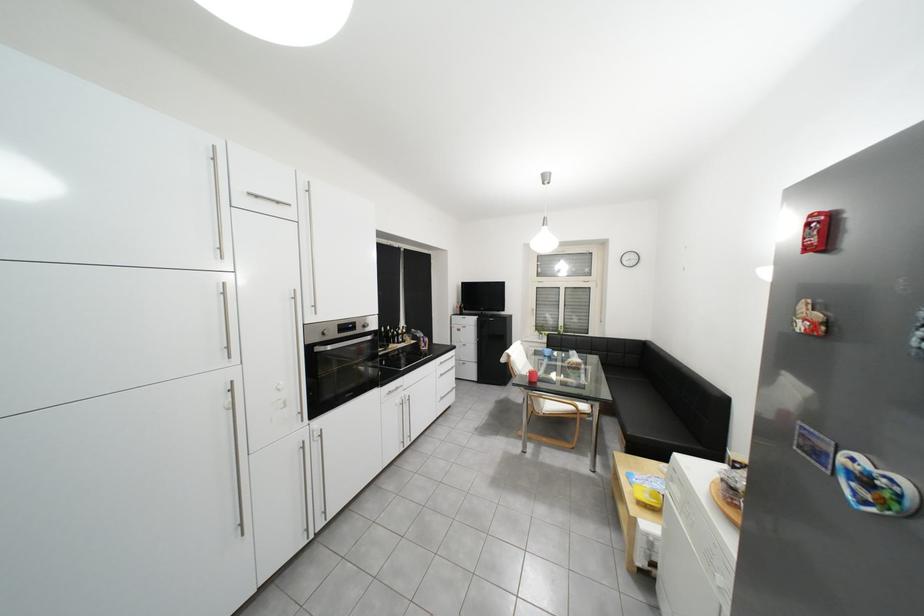
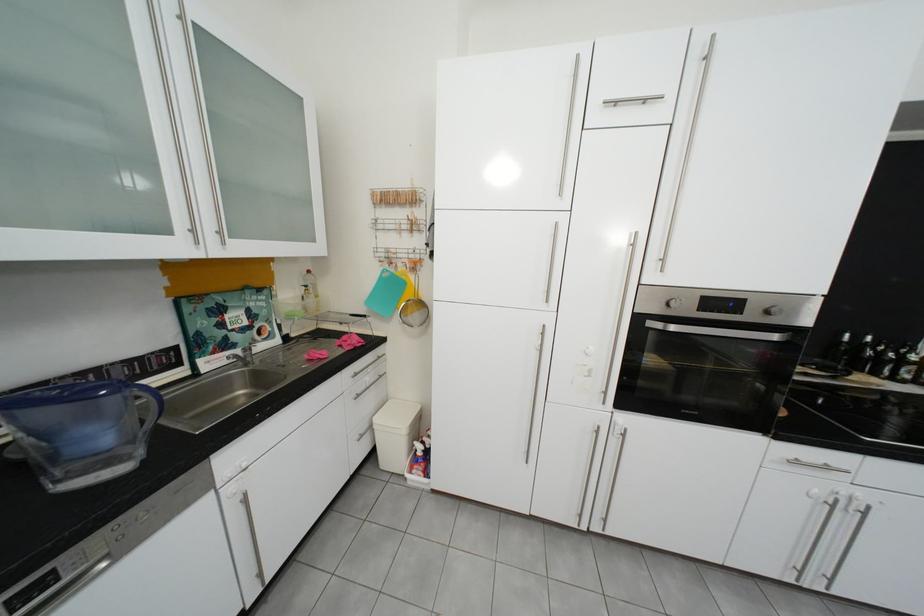
In the second image, find the point that corresponds to point 334,334 in the first image.

(679, 306)